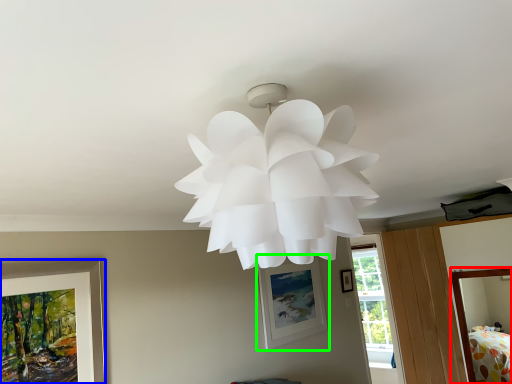
Question: Which is nearer to the bed (highlighted by a red box)? picture frame (highlighted by a blue box) or picture frame (highlighted by a green box).

Choices:
 (A) picture frame
 (B) picture frame

Answer: (B)